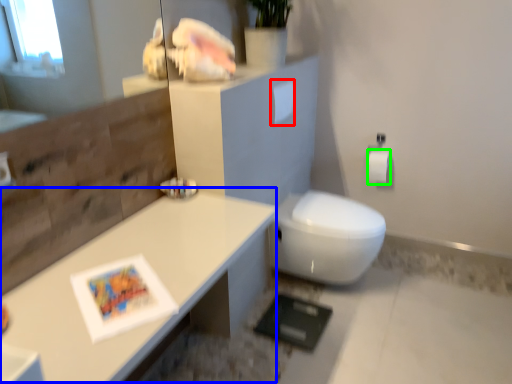
Question: Based on their relative distances, which object is nearer to toilet paper (highlighted by a red box)? Choose from table (highlighted by a blue box) and toilet paper (highlighted by a green box).

Choices:
 (A) table
 (B) toilet paper

Answer: (B)